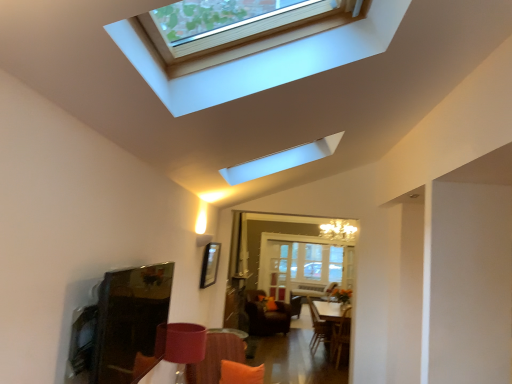
Question: From their relative heights in the image, would you say velvet orange armchair at lower center is taller or shorter than orange fabric pillow at lower center?

Choices:
 (A) tall
 (B) short

Answer: (A)

Question: From the image's perspective, is velvet orange armchair at lower center positioned above or below orange fabric pillow at lower center?

Choices:
 (A) above
 (B) below

Answer: (B)

Question: Based on their relative distances, which object is farther from the white glossy table at center?

Choices:
 (A) clear glass door at center
 (B) orange fabric pillow at lower center
 (C) velvet brown swivel chair at center, placed as the first swivel chair when sorted from left to right
 (D) velvet orange armchair at lower center
 (E) orange fabric couch at lower center

Answer: (E)

Question: Estimate the real-world distances between objects in this image. Which object is farther from the clear glass door at center?

Choices:
 (A) orange fabric pillow at lower center
 (B) orange fabric couch at lower center
 (C) matte white window at upper center
 (D) white glossy table at center
 (E) velvet brown swivel chair at center, placed as the first swivel chair when sorted from left to right

Answer: (C)